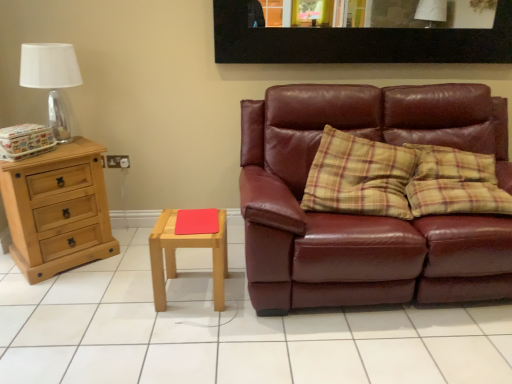
Question: Does white tile at center have a greater width compared to black matte picture frame at upper center?

Choices:
 (A) no
 (B) yes

Answer: (B)

Question: From a real-world perspective, is white tile at center under black matte picture frame at upper center?

Choices:
 (A) no
 (B) yes

Answer: (B)

Question: Is the depth of white tile at center less than that of black matte picture frame at upper center?

Choices:
 (A) yes
 (B) no

Answer: (A)

Question: Is white tile at center not near black matte picture frame at upper center?

Choices:
 (A) yes
 (B) no

Answer: (A)

Question: Is white tile at center at the left side of black matte picture frame at upper center?

Choices:
 (A) no
 (B) yes

Answer: (B)

Question: Relative to light brown wooden stool at center, is natural wood chest of drawers at left in front or behind?

Choices:
 (A) front
 (B) behind

Answer: (B)

Question: Is point (12, 246) positioned closer to the camera than point (169, 230)?

Choices:
 (A) farther
 (B) closer

Answer: (A)

Question: In terms of size, does natural wood chest of drawers at left appear bigger or smaller than light brown wooden stool at center?

Choices:
 (A) big
 (B) small

Answer: (A)

Question: Is natural wood chest of drawers at left situated inside light brown wooden stool at center or outside?

Choices:
 (A) inside
 (B) outside

Answer: (B)

Question: From their relative heights in the image, would you say light brown wooden stool at center is taller or shorter than black matte picture frame at upper center?

Choices:
 (A) tall
 (B) short

Answer: (A)

Question: From the image's perspective, is light brown wooden stool at center above or below black matte picture frame at upper center?

Choices:
 (A) below
 (B) above

Answer: (A)

Question: In the image, is light brown wooden stool at center on the left side or the right side of black matte picture frame at upper center?

Choices:
 (A) right
 (B) left

Answer: (B)

Question: In the image, is light brown wooden stool at center positioned in front of or behind black matte picture frame at upper center?

Choices:
 (A) behind
 (B) front

Answer: (B)

Question: Considering their positions, is white tile at center located in front of or behind light brown wooden stool at center?

Choices:
 (A) front
 (B) behind

Answer: (A)

Question: Is white tile at center taller or shorter than light brown wooden stool at center?

Choices:
 (A) tall
 (B) short

Answer: (B)